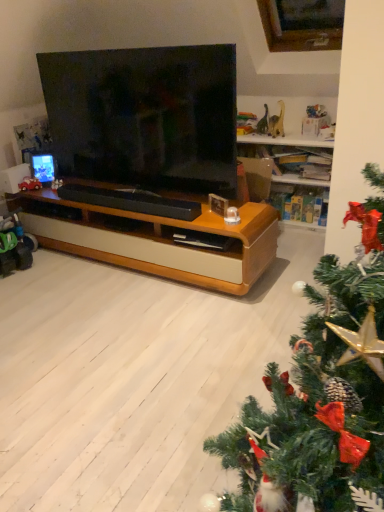
Identify the location of black matte soundbar at center. (131, 201).

Where is `metallic red car at left, positioned as the 1th toy in back-to-front order`? The height and width of the screenshot is (512, 384). metallic red car at left, positioned as the 1th toy in back-to-front order is located at coordinates (30, 184).

Is metallic red car at left, the second toy from the front, inside green plastic toy at left, the 1th toy viewed from the front?

No, metallic red car at left, the second toy from the front, is not inside green plastic toy at left, the 1th toy viewed from the front.

From a real-world perspective, which is physically below, green plastic toy at left, the 1th toy viewed from the front, or metallic red car at left, the second toy from the front?

green plastic toy at left, the 1th toy viewed from the front.

Is point (1, 245) closer or farther from the camera than point (25, 188)?

Clearly, point (1, 245) is closer to the camera than point (25, 188).

Where is `toy on the left of the metallic red car at left, positioned as the 1th toy in back-to-front order`? toy on the left of the metallic red car at left, positioned as the 1th toy in back-to-front order is located at coordinates (14, 247).

From the image's perspective, is black matte soundbar at center located above or below metallic red car at left, the second toy from the front?

Based on their image positions, black matte soundbar at center is located beneath metallic red car at left, the second toy from the front.

Between black matte soundbar at center and metallic red car at left, the 2th toy when ordered from bottom to top, which one has more height?

metallic red car at left, the 2th toy when ordered from bottom to top.

Between black matte soundbar at center and metallic red car at left, the 2th toy when ordered from bottom to top, which one has smaller width?

With smaller width is metallic red car at left, the 2th toy when ordered from bottom to top.

Based on the photo, from a real-world perspective, is black matte soundbar at center physically above metallic red car at left, the 2th toy when ordered from bottom to top?

No, from a real-world perspective, black matte soundbar at center is not over metallic red car at left, the 2th toy when ordered from bottom to top

In order to click on television above the green plastic toy at left, the 2th toy from the top (from a real-world perspective) in this screenshot , I will do `click(145, 116)`.

Is matte black tv at center far from green plastic toy at left, which ranks as the 2th toy in back-to-front order?

matte black tv at center is positioned a significant distance from green plastic toy at left, which ranks as the 2th toy in back-to-front order.

From a real-world perspective, between matte black tv at center and green plastic toy at left, placed as the 1th toy when sorted from bottom to top, who is vertically lower?

green plastic toy at left, placed as the 1th toy when sorted from bottom to top, is physically lower.

Can you confirm if matte black tv at center is taller than green plastic toy at left, placed as the 1th toy when sorted from bottom to top?

Indeed, matte black tv at center has a greater height compared to green plastic toy at left, placed as the 1th toy when sorted from bottom to top.

Between metallic red car at left, which appears as the 1th toy when viewed from the top, and black matte soundbar at center, which one appears on the right side from the viewer's perspective?

black matte soundbar at center is more to the right.

Could you tell me if metallic red car at left, which appears as the 1th toy when viewed from the top, is facing black matte soundbar at center?

No, metallic red car at left, which appears as the 1th toy when viewed from the top, does not turn towards black matte soundbar at center.

From a real-world perspective, is metallic red car at left, which appears as the 1th toy when viewed from the top, physically below black matte soundbar at center?

Incorrect, from a real-world perspective, metallic red car at left, which appears as the 1th toy when viewed from the top, is higher than black matte soundbar at center.

How distant is metallic red car at left, the 2th toy when ordered from bottom to top, from black matte soundbar at center?

26.74 inches.

From a real-world perspective, who is located lower, green plastic toy at left, the 1th toy viewed from the front, or matte black tv at center?

From a 3D spatial view, green plastic toy at left, the 1th toy viewed from the front, is below.

From the image's perspective, would you say green plastic toy at left, the 1th toy viewed from the front, is shown under matte black tv at center?

Yes, from the image's perspective, green plastic toy at left, the 1th toy viewed from the front, is beneath matte black tv at center.

Looking at this image, which object is further away from the camera taking this photo, green plastic toy at left, the 2th toy from the top, or matte black tv at center?

green plastic toy at left, the 2th toy from the top, is further from the camera.

Identify the location of television above the green plastic toy at left, the 2th toy from the top (from a real-world perspective). (145, 116).

Considering the points (8, 247) and (194, 205), which point is behind, point (8, 247) or point (194, 205)?

The point (8, 247) is behind.

From the image's perspective, which one is positioned lower, green plastic toy at left, the 1th toy viewed from the front, or black matte soundbar at center?

green plastic toy at left, the 1th toy viewed from the front.

From a real-world perspective, which object stands above the other?

In real-world perspective, black matte soundbar at center is above.

At what (x,y) coordinates should I click in order to perform the action: click on the 1st toy positioned below the matte black tv at center (from a real-world perspective). Please return your answer as a coordinate pair (x, y). Looking at the image, I should click on (30, 184).

Is metallic red car at left, positioned as the 1th toy in back-to-front order, positioned far away from matte black tv at center?

They are positioned close to each other.

Which object is wider, metallic red car at left, positioned as the 1th toy in back-to-front order, or matte black tv at center?

Wider between the two is matte black tv at center.

Would you say metallic red car at left, the 2th toy when ordered from bottom to top, is inside or outside matte black tv at center?

metallic red car at left, the 2th toy when ordered from bottom to top, is spatially situated outside matte black tv at center.

You are a GUI agent. You are given a task and a screenshot of the screen. Output one action in this format:
    pyautogui.click(x=<x>, y=<y>)
    Task: Click on the toy above the green plastic toy at left, the 2th toy from the top (from the image's perspective)
    The width and height of the screenshot is (384, 512).
    Given the screenshot: What is the action you would take?
    pyautogui.click(x=30, y=184)

Where is `toy above the black matte soundbar at center (from a real-world perspective)`? toy above the black matte soundbar at center (from a real-world perspective) is located at coordinates (30, 184).

Considering their positions, is black matte soundbar at center positioned further to metallic red car at left, which appears as the 1th toy when viewed from the top, than green plastic toy at left, the 2th toy from the top?

The object further to metallic red car at left, which appears as the 1th toy when viewed from the top, is black matte soundbar at center.

Looking at this image, considering their positions, is black matte soundbar at center positioned closer to matte black tv at center than green plastic toy at left, placed as the 1th toy when sorted from bottom to top?

black matte soundbar at center is positioned closer to the anchor matte black tv at center.

Based on their spatial positions, is metallic red car at left, which appears as the 1th toy when viewed from the top, or green plastic toy at left, placed as the 1th toy when sorted from bottom to top, further from black matte soundbar at center?

metallic red car at left, which appears as the 1th toy when viewed from the top, lies further to black matte soundbar at center than the other object.

When comparing their distances from matte black tv at center, does metallic red car at left, which appears as the 1th toy when viewed from the top, or green plastic toy at left, which ranks as the 2th toy in back-to-front order, seem closer?

Among the two, metallic red car at left, which appears as the 1th toy when viewed from the top, is located nearer to matte black tv at center.

Estimate the real-world distances between objects in this image. Which object is closer to green plastic toy at left, the 2th toy from the top, black matte soundbar at center or metallic red car at left, the second toy from the front?

The object closer to green plastic toy at left, the 2th toy from the top, is metallic red car at left, the second toy from the front.

When comparing their distances from matte black tv at center, does green plastic toy at left, the 1th toy viewed from the front, or black matte soundbar at center seem closer?

black matte soundbar at center is closer to matte black tv at center.

Considering their positions, is green plastic toy at left, which ranks as the 2th toy in back-to-front order, positioned further to metallic red car at left, the second toy from the front, than black matte soundbar at center?

black matte soundbar at center lies further to metallic red car at left, the second toy from the front, than the other object.

Considering their positions, is matte black tv at center positioned further to green plastic toy at left, the 2th toy from the top, than metallic red car at left, the 2th toy when ordered from bottom to top?

matte black tv at center is positioned further to the anchor green plastic toy at left, the 2th toy from the top.

The height and width of the screenshot is (512, 384). Identify the location of the footrest located between green plastic toy at left, the 1th toy viewed from the front, and matte black tv at center in the left-right direction. (131, 201).

At what (x,y) coordinates should I click in order to perform the action: click on toy located between green plastic toy at left, placed as the 1th toy when sorted from bottom to top, and matte black tv at center in the left-right direction. Please return your answer as a coordinate pair (x, y). This screenshot has width=384, height=512. Looking at the image, I should click on (30, 184).

The height and width of the screenshot is (512, 384). I want to click on toy between green plastic toy at left, the 1th toy viewed from the front, and black matte soundbar at center from left to right, so click(30, 184).

The width and height of the screenshot is (384, 512). Identify the location of the footrest positioned between matte black tv at center and metallic red car at left, which appears as the 1th toy when viewed from the top, from near to far. (131, 201).